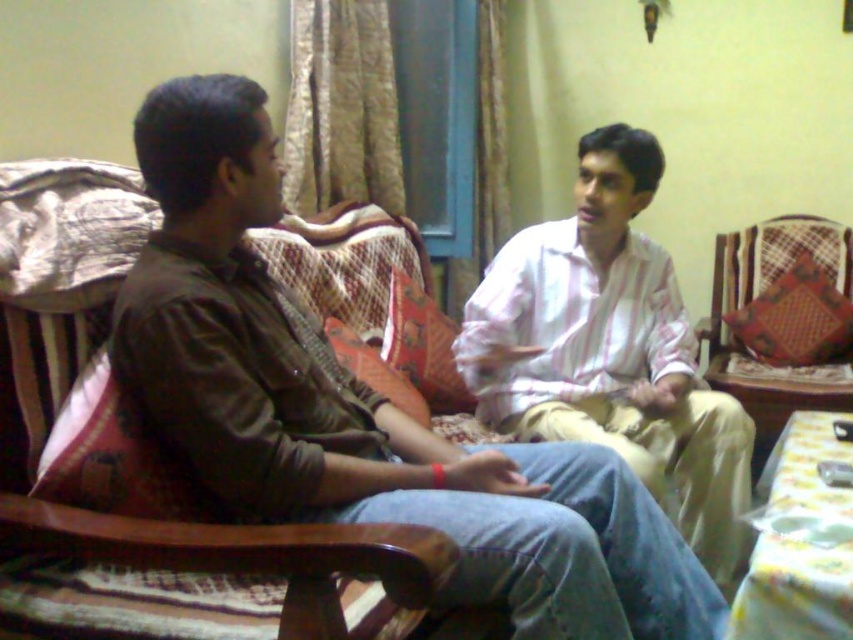
Question: Can you confirm if dark brown shirt at left is positioned below pink striped shirt at center?

Choices:
 (A) no
 (B) yes

Answer: (B)

Question: Which of the following is the farthest from the observer?

Choices:
 (A) (x=799, y=320)
 (B) (x=605, y=243)
 (C) (x=370, y=468)

Answer: (A)

Question: Can you confirm if dark brown shirt at left is positioned below wooden chair at right?

Choices:
 (A) yes
 (B) no

Answer: (A)

Question: Does pink striped shirt at center appear over wooden chair at right?

Choices:
 (A) no
 (B) yes

Answer: (A)

Question: Based on their relative distances, which object is nearer to the wooden chair at right?

Choices:
 (A) pink striped shirt at center
 (B) dark brown shirt at left

Answer: (A)

Question: Which point is closer to the camera taking this photo?

Choices:
 (A) (583, 208)
 (B) (735, 246)

Answer: (A)